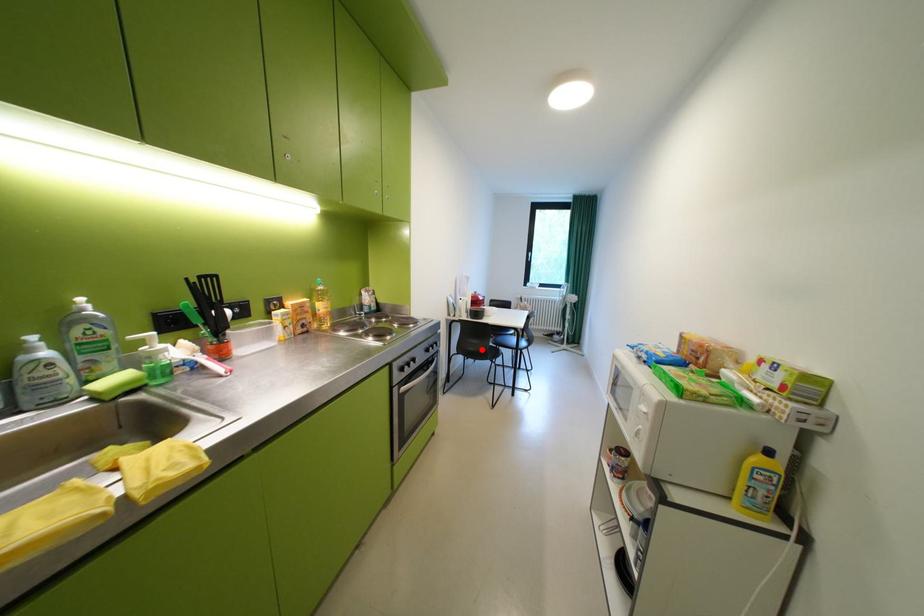
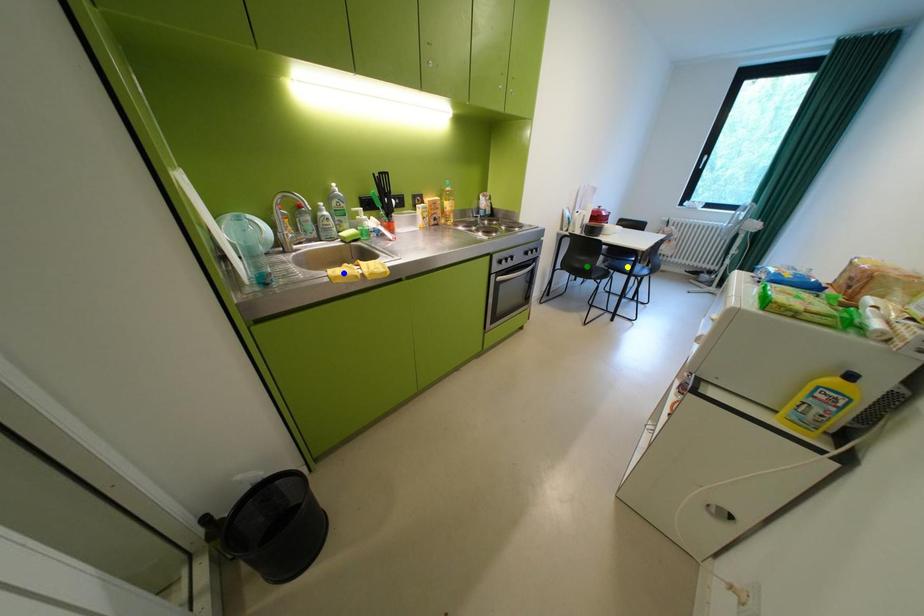
Question: I am providing you with two images of the same scene from different viewpoints. A red point is marked on the first image. You are given multiple points on the second image. Which point in image 2 represents the same 3d spot as the red point in image 1?

Choices:
 (A) green point
 (B) blue point
 (C) yellow point

Answer: (A)